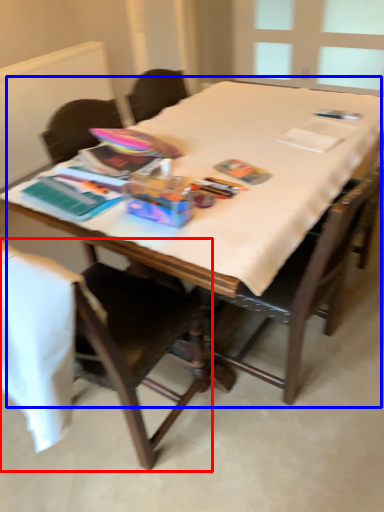
Question: Which object is further to the camera taking this photo, chair (highlighted by a red box) or table (highlighted by a blue box)?

Choices:
 (A) chair
 (B) table

Answer: (B)